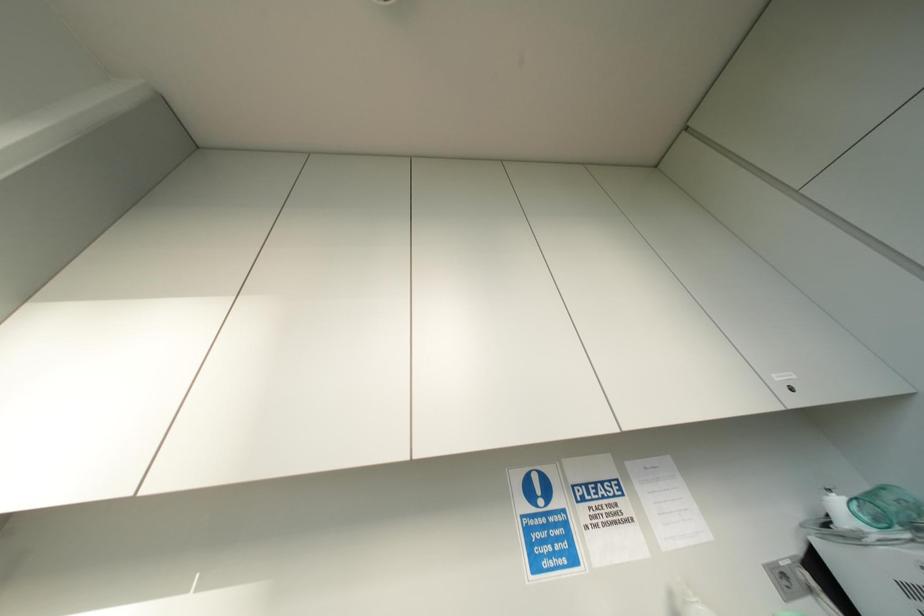
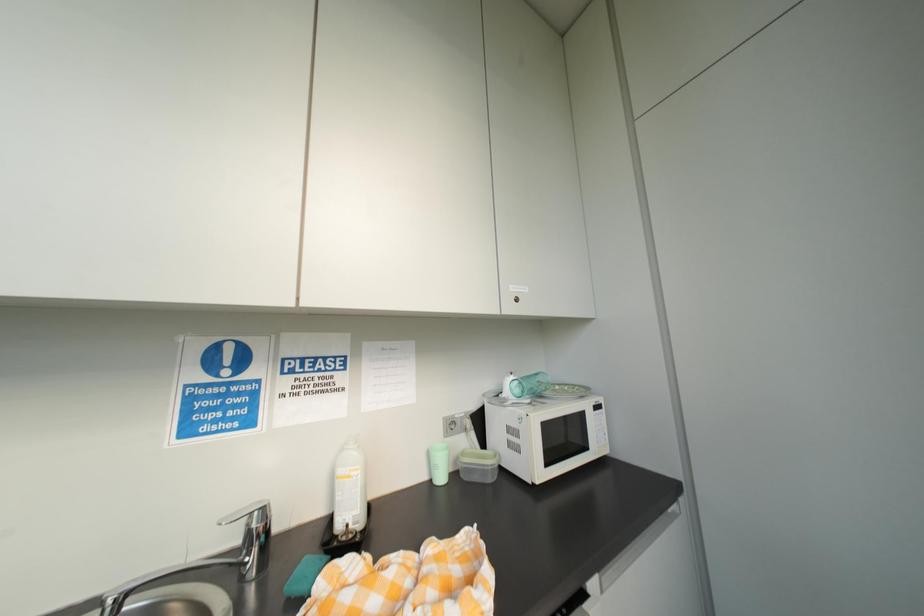
First-person continuous shooting, in which direction is the camera rotating?

The camera's rotation is toward right-down.